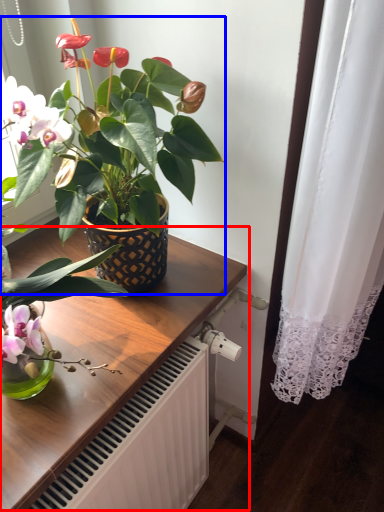
Question: Which object appears farthest to the camera in this image, table (highlighted by a red box) or houseplant (highlighted by a blue box)?

Choices:
 (A) table
 (B) houseplant

Answer: (A)